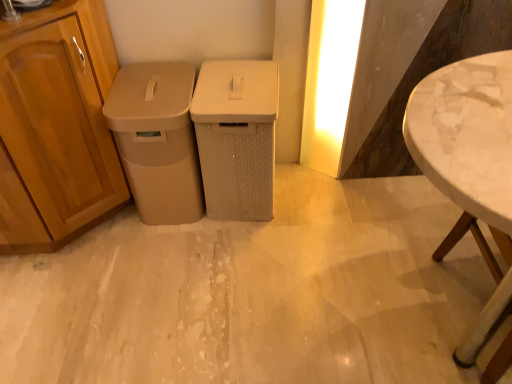
I want to click on vacant area that lies in front of yellow matte light at upper right, so click(x=327, y=192).